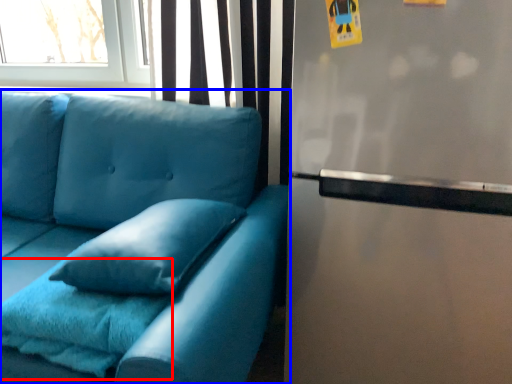
Question: Which point is further to the camera, blanket (highlighted by a red box) or studio couch (highlighted by a blue box)?

Choices:
 (A) blanket
 (B) studio couch

Answer: (A)